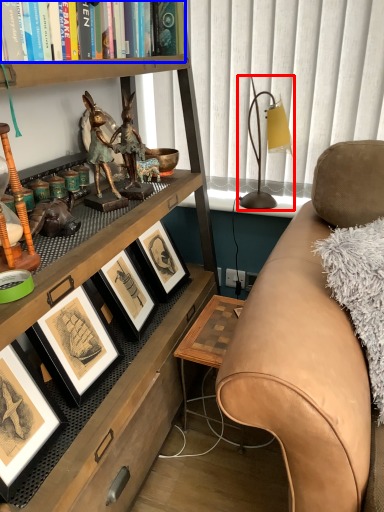
Question: Which object appears closest to the camera in this image, table lamp (highlighted by a red box) or book (highlighted by a blue box)?

Choices:
 (A) table lamp
 (B) book

Answer: (B)